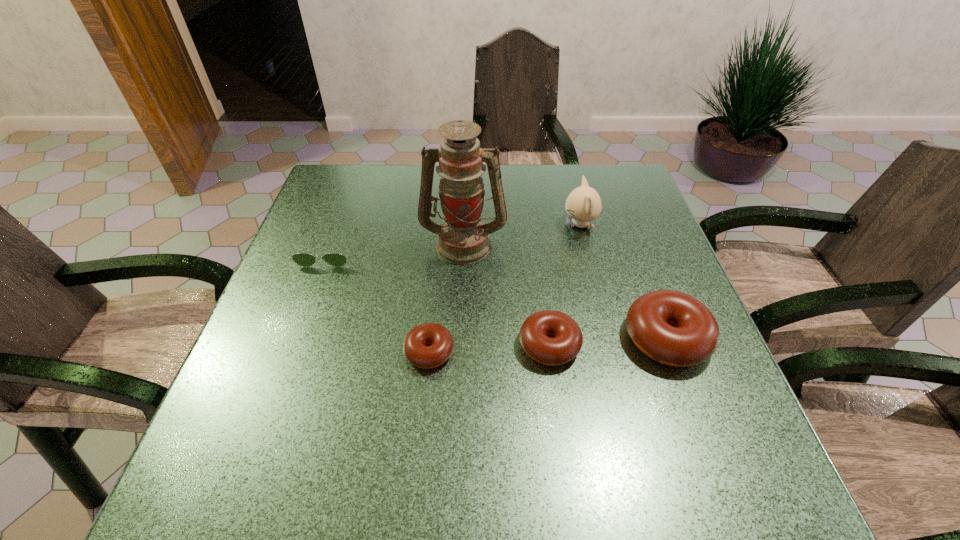
What are the coordinates of `vacant region located 0.130m on the left of the rightmost doughnut` in the screenshot? It's located at 560,339.

Find the location of a particular element. Image resolution: width=960 pixels, height=540 pixels. free spot located 0.100m on the face of the kitten is located at coordinates (524, 225).

The image size is (960, 540). I want to click on vacant space located 0.210m on the face of the kitten, so click(483, 225).

Image resolution: width=960 pixels, height=540 pixels. Identify the location of free space located on the face of the kitten. (468, 225).

Image resolution: width=960 pixels, height=540 pixels. I want to click on free location located 0.170m on the back of the oil lamp, so (x=466, y=188).

Find the location of a particular element. The width and height of the screenshot is (960, 540). free spot located on the front-facing side of the sunglasses is located at coordinates (311, 299).

At what (x,y) coordinates should I click in order to perform the action: click on object located in the left edge section of the desktop. Please return your answer as a coordinate pair (x, y). Looking at the image, I should click on (302, 259).

Where is `doughnut that is positioned at the right edge`? This screenshot has height=540, width=960. doughnut that is positioned at the right edge is located at coordinates pyautogui.click(x=671, y=327).

Locate an element on the screen. The image size is (960, 540). kitten that is at the right edge is located at coordinates (583, 204).

Identify the location of vacant space at the far edge. (534, 179).